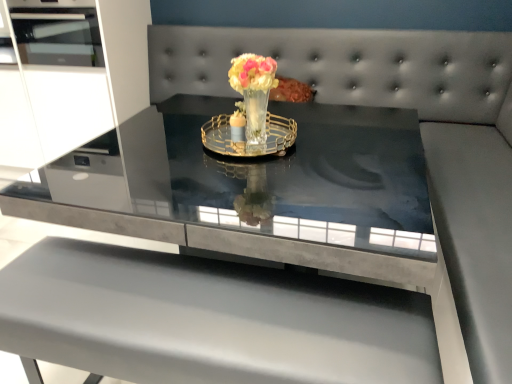
Image resolution: width=512 pixels, height=384 pixels. I want to click on vacant area in front of translucent glass vase at center, so click(259, 170).